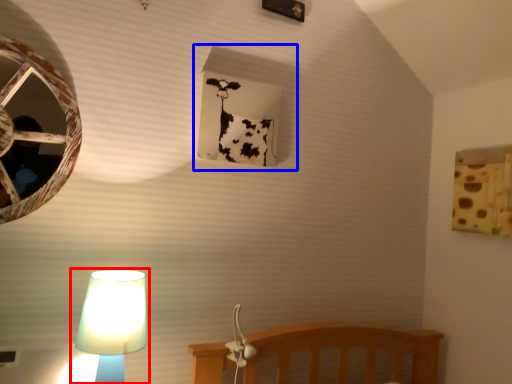
Question: Which of the following is the closest to the observer, lamp (highlighted by a red box) or window frame (highlighted by a blue box)?

Choices:
 (A) lamp
 (B) window frame

Answer: (A)